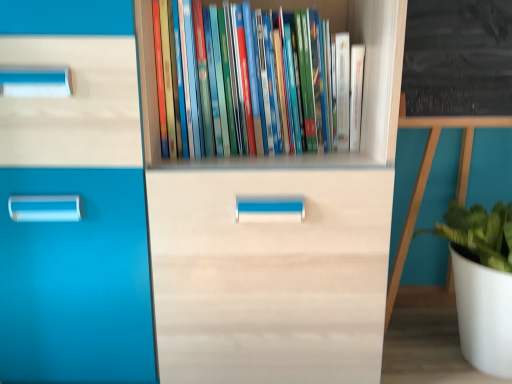
Question: Considering the positions of white matte pot at right and hardcover books at center in the image, is white matte pot at right bigger or smaller than hardcover books at center?

Choices:
 (A) small
 (B) big

Answer: (B)

Question: Is point (480, 354) positioned closer to the camera than point (252, 119)?

Choices:
 (A) farther
 (B) closer

Answer: (A)

Question: From a real-world perspective, is white matte pot at right positioned above or below hardcover books at center?

Choices:
 (A) above
 (B) below

Answer: (B)

Question: Visually, is hardcover books at center positioned to the left or to the right of white matte pot at right?

Choices:
 (A) right
 (B) left

Answer: (B)

Question: Choose the correct answer: Is hardcover books at center inside white matte pot at right or outside it?

Choices:
 (A) inside
 (B) outside

Answer: (B)

Question: From a real-world perspective, relative to white matte pot at right, is hardcover books at center vertically above or below?

Choices:
 (A) below
 (B) above

Answer: (B)

Question: Looking at their shapes, would you say hardcover books at center is wider or thinner than white matte pot at right?

Choices:
 (A) thin
 (B) wide

Answer: (A)